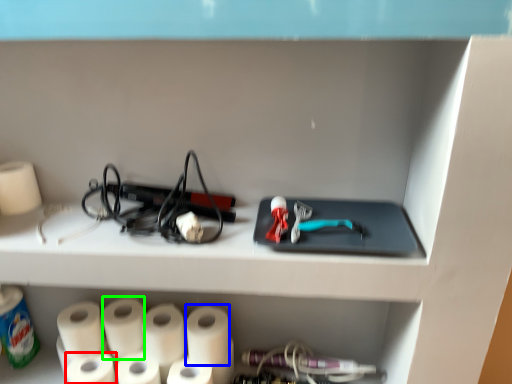
Question: Considering the real-world distances, which object is closest to toilet paper (highlighted by a red box)? paper towel (highlighted by a blue box) or paper towel (highlighted by a green box).

Choices:
 (A) paper towel
 (B) paper towel

Answer: (B)